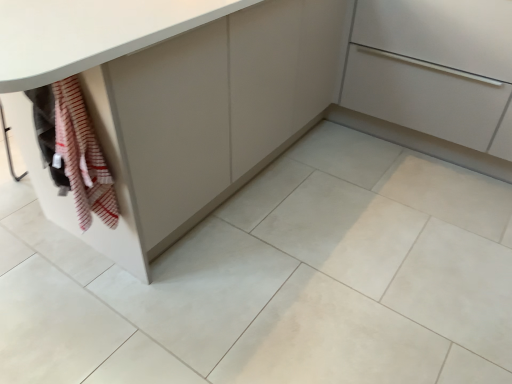
Question: From a real-world perspective, does matte gray cabinet at lower left, acting as the second cabinetry starting from the right, stand above matte white cabinet at center, placed as the first cabinetry when sorted from right to left?

Choices:
 (A) no
 (B) yes

Answer: (B)

Question: Considering the relative sizes of matte gray cabinet at lower left, acting as the second cabinetry starting from the right, and matte white cabinet at center, the 2th cabinetry viewed from the left, in the image provided, is matte gray cabinet at lower left, acting as the second cabinetry starting from the right, thinner than matte white cabinet at center, the 2th cabinetry viewed from the left,?

Choices:
 (A) no
 (B) yes

Answer: (A)

Question: Is matte white cabinet at center, placed as the first cabinetry when sorted from right to left, at the back of matte gray cabinet at lower left, the 1th cabinetry viewed from the left?

Choices:
 (A) yes
 (B) no

Answer: (B)

Question: Is matte gray cabinet at lower left, the 1th cabinetry viewed from the left, wider than matte white cabinet at center, the 2th cabinetry viewed from the left?

Choices:
 (A) yes
 (B) no

Answer: (A)

Question: Is matte gray cabinet at lower left, the 1th cabinetry viewed from the left, facing towards matte white cabinet at center, placed as the first cabinetry when sorted from right to left?

Choices:
 (A) yes
 (B) no

Answer: (B)

Question: From a real-world perspective, relative to matte gray cabinet at lower left, acting as the second cabinetry starting from the right, is striped cotton towel at lower left vertically above or below?

Choices:
 (A) above
 (B) below

Answer: (A)

Question: Considering the positions of striped cotton towel at lower left and matte gray cabinet at lower left, the 1th cabinetry viewed from the left, in the image, is striped cotton towel at lower left taller or shorter than matte gray cabinet at lower left, the 1th cabinetry viewed from the left,?

Choices:
 (A) short
 (B) tall

Answer: (A)

Question: Would you say striped cotton towel at lower left is inside or outside matte gray cabinet at lower left, the 1th cabinetry viewed from the left?

Choices:
 (A) inside
 (B) outside

Answer: (A)

Question: In the image, is striped cotton towel at lower left positioned in front of or behind matte gray cabinet at lower left, the 1th cabinetry viewed from the left?

Choices:
 (A) behind
 (B) front

Answer: (A)

Question: Considering the positions of point (6, 321) and point (165, 230), is point (6, 321) closer or farther from the camera than point (165, 230)?

Choices:
 (A) farther
 (B) closer

Answer: (B)

Question: Considering the positions of white glossy tile at lower left and matte gray cabinet at lower left, acting as the second cabinetry starting from the right, in the image, is white glossy tile at lower left bigger or smaller than matte gray cabinet at lower left, acting as the second cabinetry starting from the right,?

Choices:
 (A) small
 (B) big

Answer: (A)

Question: From a real-world perspective, is white glossy tile at lower left physically located above or below matte gray cabinet at lower left, the 1th cabinetry viewed from the left?

Choices:
 (A) above
 (B) below

Answer: (B)

Question: Would you say white glossy tile at lower left is to the left or to the right of matte gray cabinet at lower left, the 1th cabinetry viewed from the left, in the picture?

Choices:
 (A) left
 (B) right

Answer: (A)

Question: From a real-world perspective, is matte white cabinet at center, the 2th cabinetry viewed from the left, physically located above or below striped cotton towel at lower left?

Choices:
 (A) below
 (B) above

Answer: (A)

Question: Is point click(x=440, y=119) positioned closer to the camera than point click(x=103, y=193)?

Choices:
 (A) closer
 (B) farther

Answer: (B)